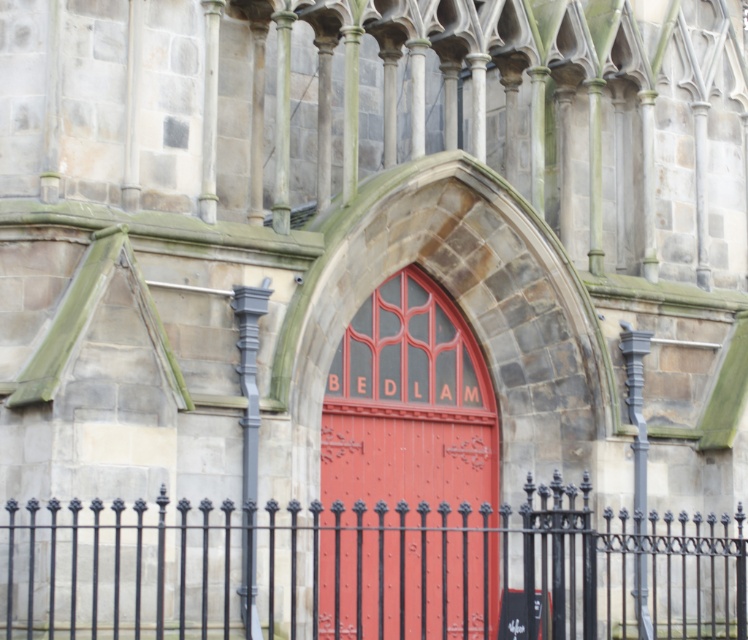
You are a delivery person trying to pass through the entrance. The black wrought iron fence at lower center and the smooth red door at center are both in your path. Which one is wider so you can choose the correct path?

The black wrought iron fence at lower center is wider than the smooth red door at center, so you should choose the black wrought iron fence at lower center to pass through.

You are a painter hired to paint both the black wrought iron fence at lower center and the smooth red door at center. Which object requires more paint because it has a larger surface area?

The black wrought iron fence at lower center requires more paint because it has a larger surface area than the smooth red door at center.